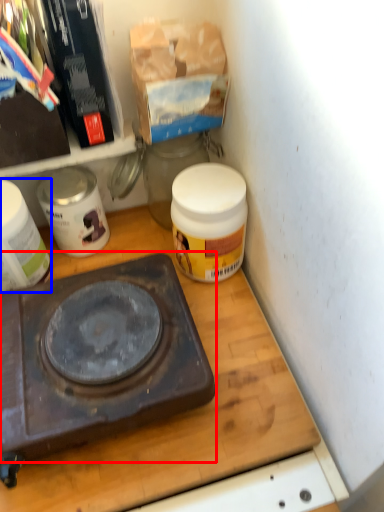
Question: Which point is closer to the camera, gas stove (highlighted by a red box) or appliance (highlighted by a blue box)?

Choices:
 (A) gas stove
 (B) appliance

Answer: (A)